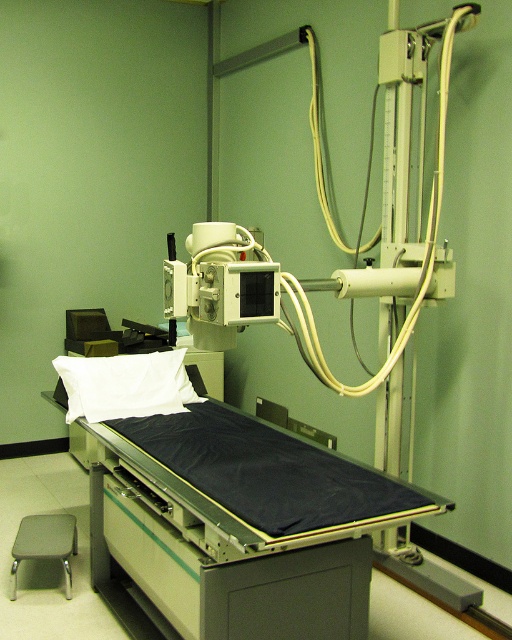
Question: Which object is the closest to the gray fabric stool at lower left?

Choices:
 (A) white soft pillow at center
 (B) black matte bed at center

Answer: (A)

Question: Estimate the real-world distances between objects in this image. Which object is farther from the black matte bed at center?

Choices:
 (A) gray fabric stool at lower left
 (B) white soft pillow at center

Answer: (A)

Question: Is black matte bed at center positioned behind gray fabric stool at lower left?

Choices:
 (A) no
 (B) yes

Answer: (A)

Question: Estimate the real-world distances between objects in this image. Which object is closer to the black matte bed at center?

Choices:
 (A) white soft pillow at center
 (B) gray fabric stool at lower left

Answer: (A)

Question: Is black matte bed at center behind gray fabric stool at lower left?

Choices:
 (A) yes
 (B) no

Answer: (B)

Question: Is black matte bed at center closer to camera compared to white soft pillow at center?

Choices:
 (A) no
 (B) yes

Answer: (B)